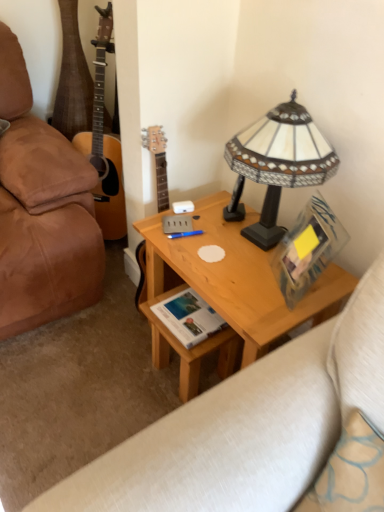
At what (x,y) coordinates should I click in order to perform the action: click on vacant area that lies in front of stained glass lampshade at upper right. Please return your answer as a coordinate pair (x, y). Looking at the image, I should click on (262, 290).